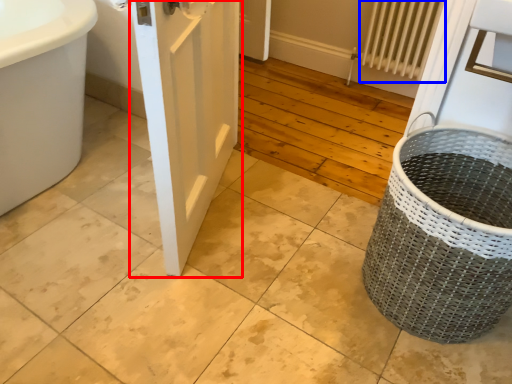
Question: Which of the following is the farthest to the observer, door (highlighted by a red box) or radiator (highlighted by a blue box)?

Choices:
 (A) door
 (B) radiator

Answer: (B)